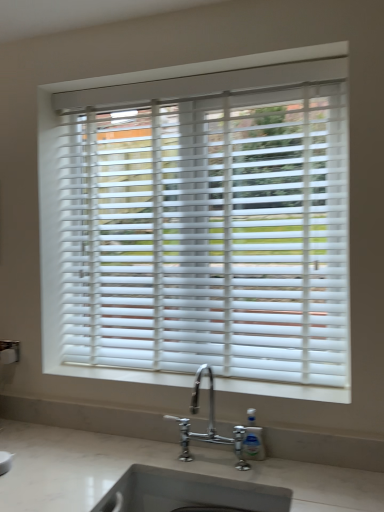
What are the coordinates of `free spot behind chrome metallic faucet at lower center` in the screenshot? It's located at (209, 448).